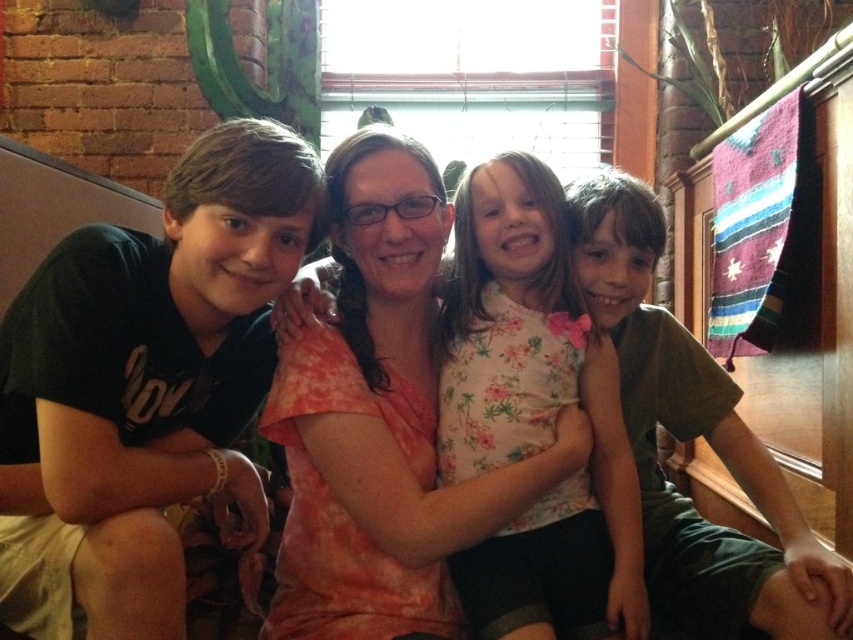
Does black cotton shirt at left appear over orange tie-dye shirt at center?

Yes, black cotton shirt at left is above orange tie-dye shirt at center.

Between point (175, 435) and point (430, 374), which one is positioned behind?

The point (430, 374) is more distant.

At what (x,y) coordinates should I click in order to perform the action: click on black cotton shirt at left. Please return your answer as a coordinate pair (x, y). This screenshot has height=640, width=853. Looking at the image, I should click on (148, 384).

Between black cotton shirt at left and matte green shirt at right, which one is positioned higher?

Positioned higher is black cotton shirt at left.

Looking at this image, does black cotton shirt at left appear on the left side of matte green shirt at right?

Correct, you'll find black cotton shirt at left to the left of matte green shirt at right.

Does point (74, 586) lie behind point (764, 632)?

No, (74, 586) is in front of (764, 632).

This screenshot has width=853, height=640. What are the coordinates of `black cotton shirt at left` in the screenshot? It's located at (148, 384).

Does floral fabric dress at center have a lesser width compared to matte green shirt at right?

Indeed, floral fabric dress at center has a lesser width compared to matte green shirt at right.

Between point (514, 388) and point (608, 291), which one is positioned behind?

The point (608, 291) is behind.

Locate an element on the screen. floral fabric dress at center is located at coordinates (534, 417).